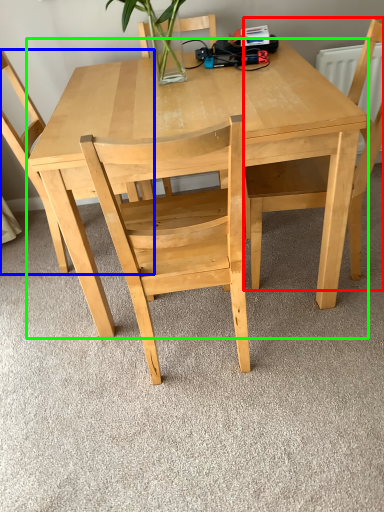
Question: Which object is positioned closest to chair (highlighted by a red box)? Select from chair (highlighted by a blue box) and table (highlighted by a green box).

Choices:
 (A) chair
 (B) table

Answer: (B)